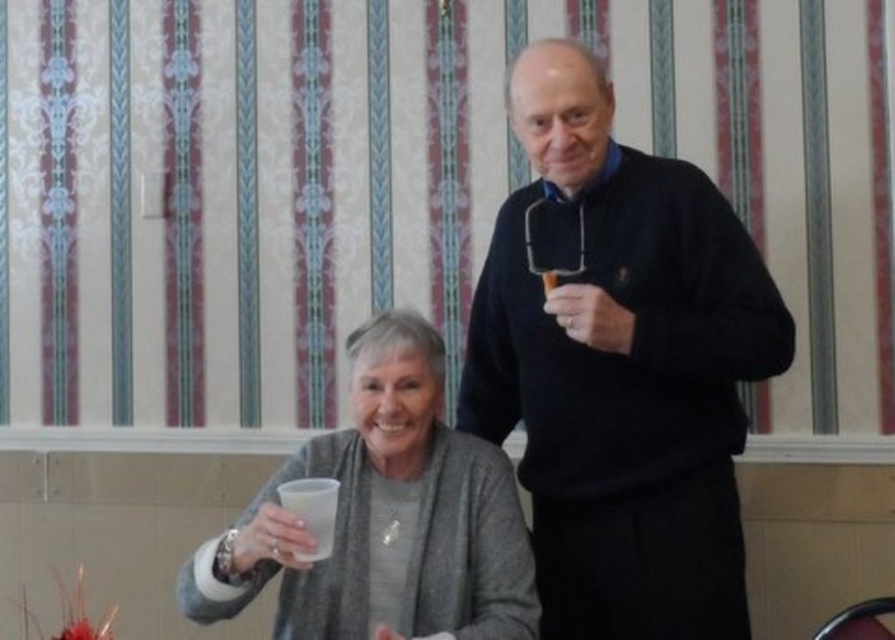
Between black matte sweater at center and translucent plastic cup at center, which one is positioned lower?

translucent plastic cup at center

Can you confirm if black matte sweater at center is shorter than translucent plastic cup at center?

No, black matte sweater at center is not shorter than translucent plastic cup at center.

Does point (634, 332) lie in front of point (435, 388)?

Yes, point (634, 332) is closer to viewer.

Where is `black matte sweater at center`? This screenshot has height=640, width=895. black matte sweater at center is located at coordinates (620, 365).